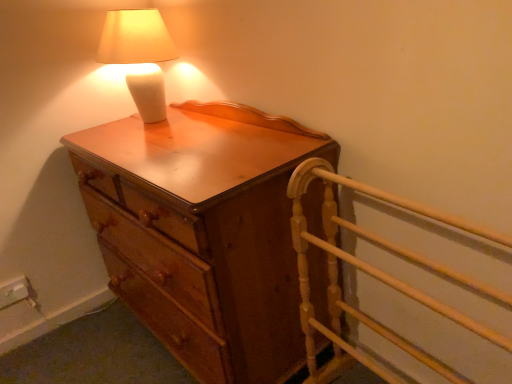
Question: From the image's perspective, is matte white lamp at upper left on top of light wood bed frame at right?

Choices:
 (A) no
 (B) yes

Answer: (B)

Question: From the image's perspective, would you say matte white lamp at upper left is shown under light wood bed frame at right?

Choices:
 (A) no
 (B) yes

Answer: (A)

Question: Does matte white lamp at upper left have a lesser width compared to light wood bed frame at right?

Choices:
 (A) yes
 (B) no

Answer: (A)

Question: Does matte white lamp at upper left have a greater height compared to light wood bed frame at right?

Choices:
 (A) no
 (B) yes

Answer: (A)

Question: Is matte white lamp at upper left next to light wood bed frame at right?

Choices:
 (A) yes
 (B) no

Answer: (B)

Question: In the image, is light wood bed frame at right on the left side or the right side of matte white lamp at upper left?

Choices:
 (A) right
 (B) left

Answer: (A)

Question: Is light wood bed frame at right situated inside matte white lamp at upper left or outside?

Choices:
 (A) outside
 (B) inside

Answer: (A)

Question: From the image's perspective, is light wood bed frame at right above or below matte white lamp at upper left?

Choices:
 (A) above
 (B) below

Answer: (B)

Question: Is light wood bed frame at right wider or thinner than matte white lamp at upper left?

Choices:
 (A) thin
 (B) wide

Answer: (B)

Question: Is point (138, 34) positioned closer to the camera than point (456, 279)?

Choices:
 (A) closer
 (B) farther

Answer: (B)

Question: Is matte white lamp at upper left in front of or behind light wood bed frame at right in the image?

Choices:
 (A) front
 (B) behind

Answer: (B)

Question: In terms of height, does matte white lamp at upper left look taller or shorter compared to light wood bed frame at right?

Choices:
 (A) short
 (B) tall

Answer: (A)

Question: From the image's perspective, is matte white lamp at upper left positioned above or below light wood bed frame at right?

Choices:
 (A) below
 (B) above

Answer: (B)

Question: Relative to wooden chest of drawers at center, is matte white lamp at upper left in front or behind?

Choices:
 (A) behind
 (B) front

Answer: (A)

Question: In terms of size, does matte white lamp at upper left appear bigger or smaller than wooden chest of drawers at center?

Choices:
 (A) big
 (B) small

Answer: (B)